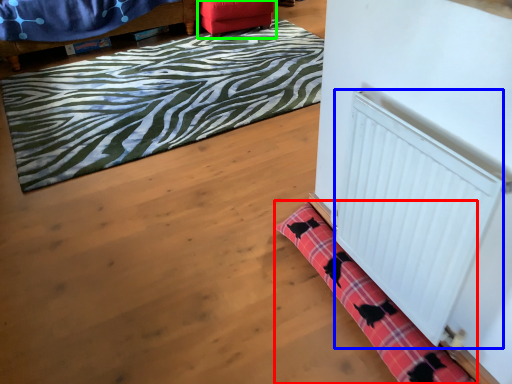
Question: Estimate the real-world distances between objects in this image. Which object is closer to bath mat (highlighted by a red box), radiator (highlighted by a blue box) or furniture (highlighted by a green box)?

Choices:
 (A) radiator
 (B) furniture

Answer: (A)